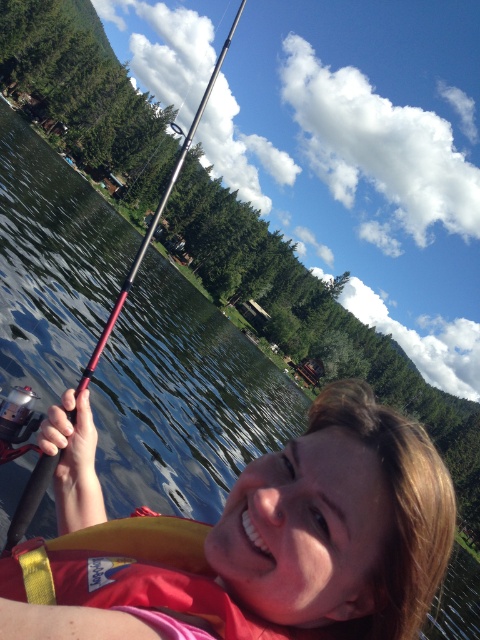
Is matte yellow life vest at lower center smaller than yellow fabric life jacket at lower center?

No, matte yellow life vest at lower center is not smaller than yellow fabric life jacket at lower center.

Does matte yellow life vest at lower center have a greater height compared to yellow fabric life jacket at lower center?

Yes, matte yellow life vest at lower center is taller than yellow fabric life jacket at lower center.

The width and height of the screenshot is (480, 640). What are the coordinates of `matte yellow life vest at lower center` in the screenshot? It's located at (250, 540).

Is matte yellow life vest at lower center smaller than metallic fishing pole at upper left?

Yes, matte yellow life vest at lower center is smaller than metallic fishing pole at upper left.

Who is more distant from viewer, (305, 464) or (33, 504)?

The point (33, 504) is more distant.

The height and width of the screenshot is (640, 480). What do you see at coordinates (250, 540) in the screenshot? I see `matte yellow life vest at lower center` at bounding box center [250, 540].

This screenshot has height=640, width=480. I want to click on matte yellow life vest at lower center, so click(x=250, y=540).

Can you confirm if yellow fabric life jacket at lower center is taller than metallic fishing pole at upper left?

Answer: Incorrect, yellow fabric life jacket at lower center's height is not larger of metallic fishing pole at upper left's.

Is yellow fabric life jacket at lower center wider than metallic fishing pole at upper left?

No, yellow fabric life jacket at lower center is not wider than metallic fishing pole at upper left.

Is point (147, 566) more distant than point (211, 83)?

That is False.

This screenshot has width=480, height=640. Identify the location of yellow fabric life jacket at lower center. (135, 576).